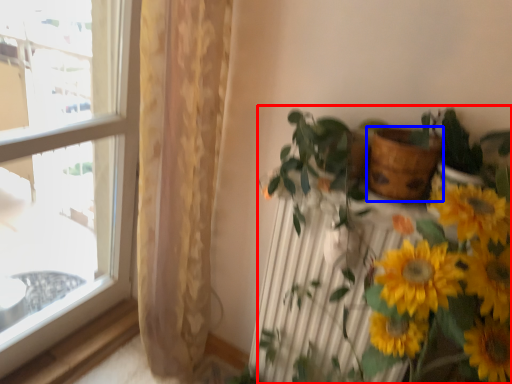
Question: Which object appears farthest to the camera in this image, houseplant (highlighted by a red box) or flowerpot (highlighted by a blue box)?

Choices:
 (A) houseplant
 (B) flowerpot

Answer: (B)